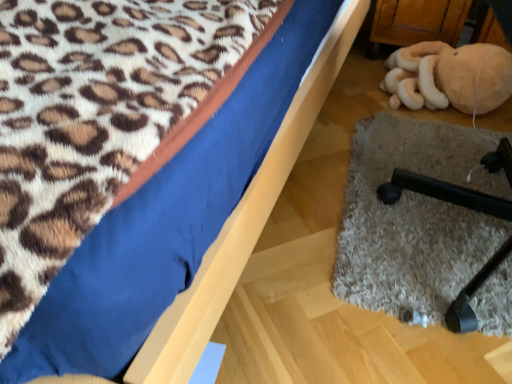
Question: Is beige plush toy at lower right spatially inside black rubber chair leg at lower right, or outside of it?

Choices:
 (A) outside
 (B) inside

Answer: (A)

Question: Would you say beige plush toy at lower right is to the left or to the right of black rubber chair leg at lower right in the picture?

Choices:
 (A) right
 (B) left

Answer: (A)

Question: Estimate the real-world distances between objects in this image. Which object is farther from the blue fabric bed at upper left?

Choices:
 (A) black rubber chair leg at lower right
 (B) beige plush toy at lower right

Answer: (B)

Question: Which is nearer to the blue fabric bed at upper left?

Choices:
 (A) black rubber chair leg at lower right
 (B) beige plush toy at lower right

Answer: (A)